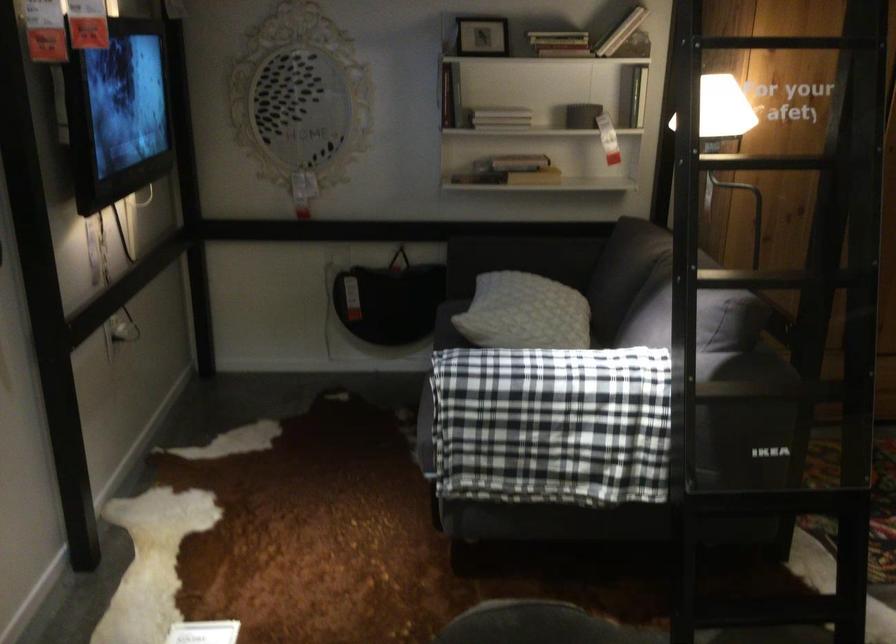
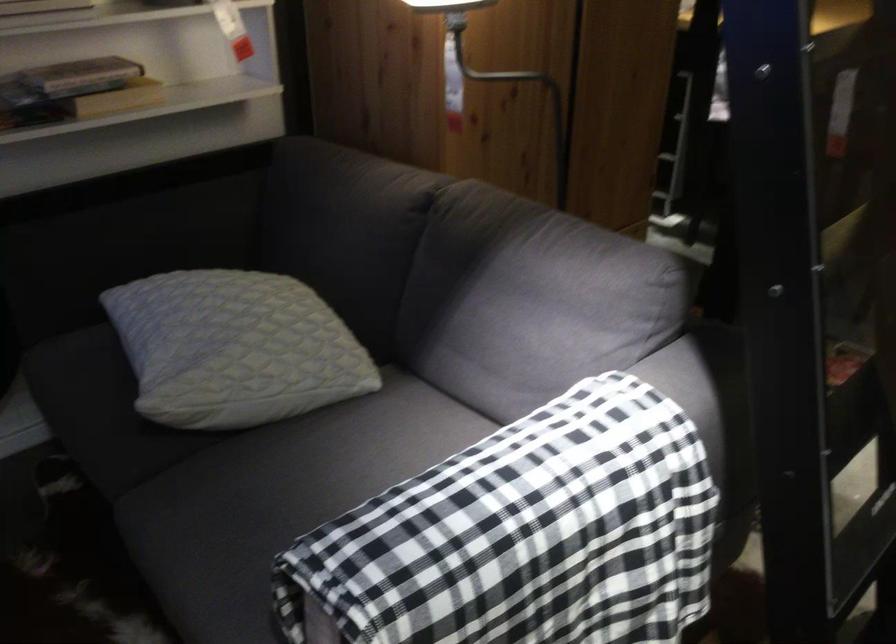
In the second image, find the point that corresponds to [530,386] in the first image.

(522, 536)